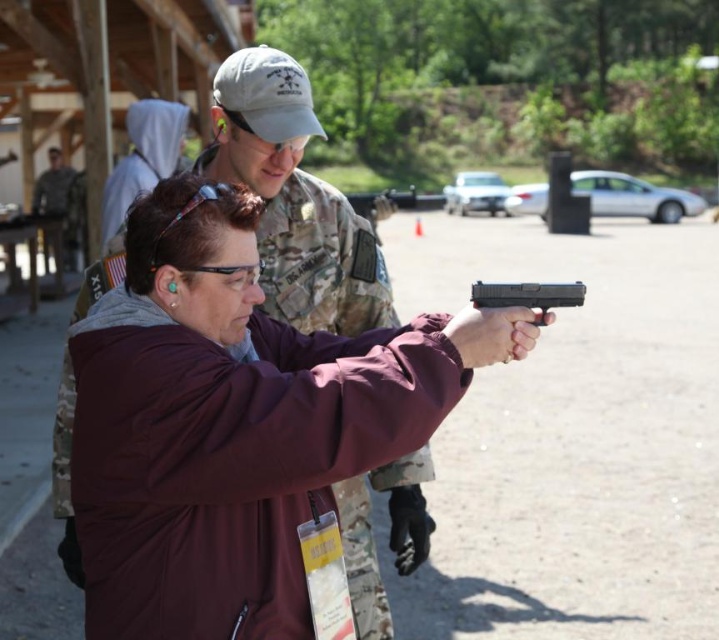
Question: Which is nearer to the black plastic handgun at center?

Choices:
 (A) camouflage uniform at center
 (B) maroon fabric jacket at center

Answer: (B)

Question: Does maroon fabric jacket at center appear on the right side of black plastic handgun at center?

Choices:
 (A) no
 (B) yes

Answer: (A)

Question: Can you confirm if black plastic handgun at center is wider than camouflage uniform at center?

Choices:
 (A) yes
 (B) no

Answer: (B)

Question: Which point appears closest to the camera in this image?

Choices:
 (A) (58, 170)
 (B) (521, 296)
 (C) (209, 403)

Answer: (C)

Question: Can you confirm if black plastic handgun at center is bigger than camouflage uniform at center?

Choices:
 (A) yes
 (B) no

Answer: (B)

Question: Which of the following is the closest to the observer?

Choices:
 (A) camouflage uniform at center
 (B) maroon fabric jacket at center

Answer: (B)